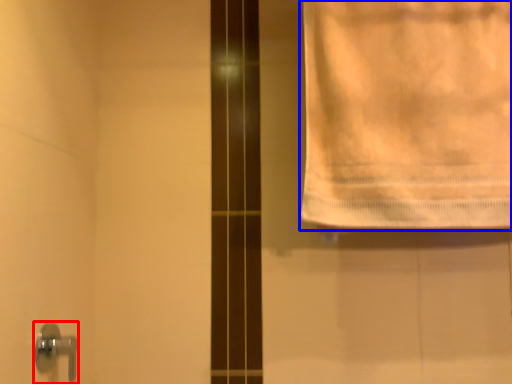
Question: Among these objects, which one is nearest to the camera, door handle (highlighted by a red box) or towel (highlighted by a blue box)?

Choices:
 (A) door handle
 (B) towel

Answer: (A)